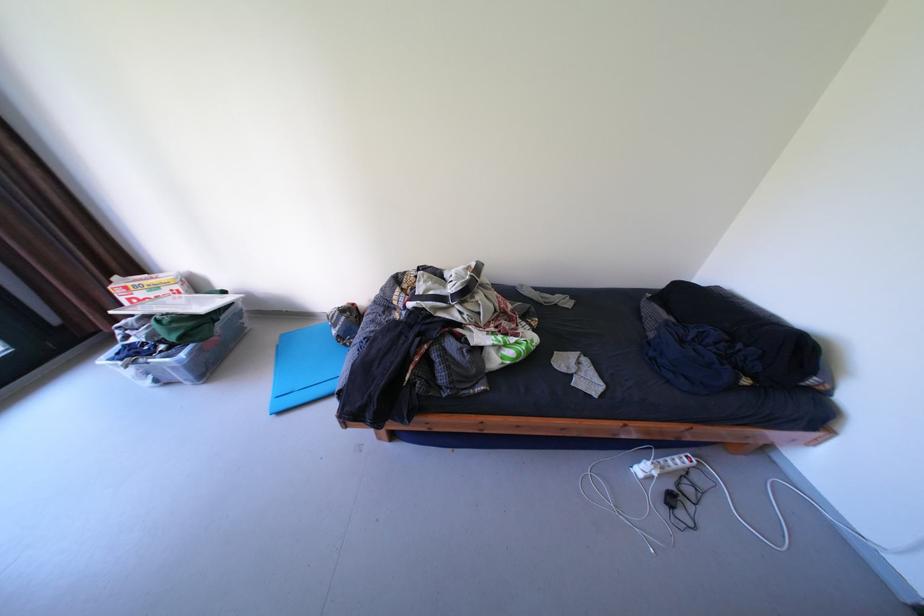
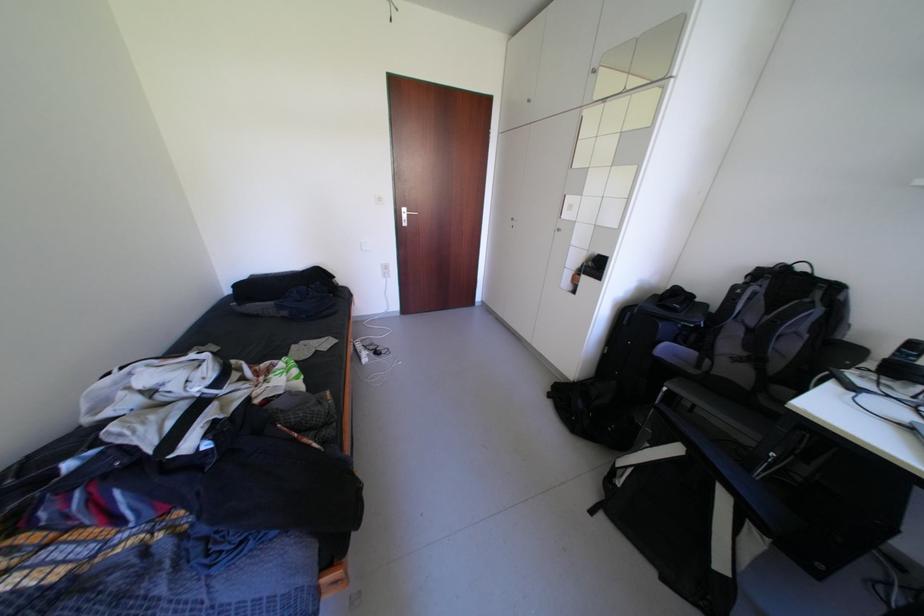
How did the camera likely rotate?

The camera's rotation is toward right-down.